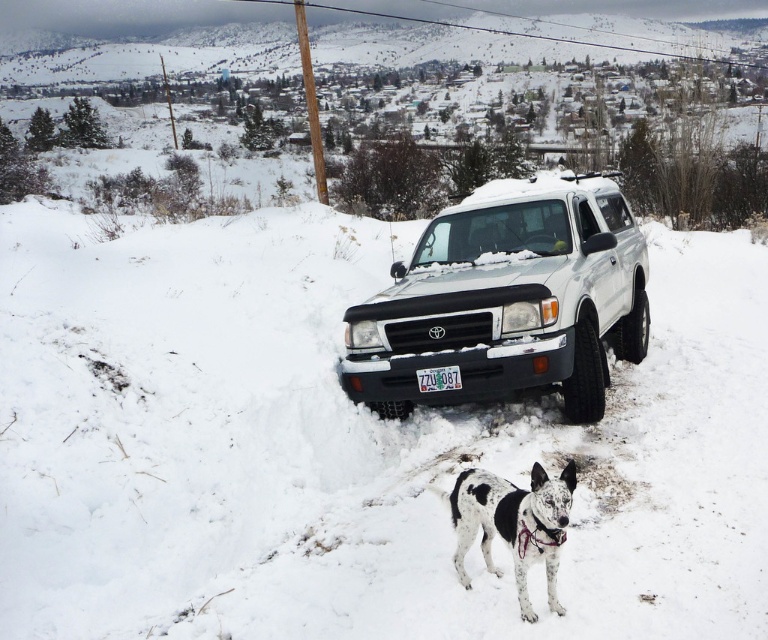
Question: Can you confirm if white matte suv at center is positioned above spotted fur dog at center?

Choices:
 (A) no
 (B) yes

Answer: (B)

Question: Which of these objects is positioned closest to the spotted fur dog at center?

Choices:
 (A) white plastic license plate at center
 (B) white matte suv at center

Answer: (A)

Question: Which of the following is the closest to the observer?

Choices:
 (A) (551, 576)
 (B) (469, 292)
 (C) (445, 374)

Answer: (A)

Question: Is white matte suv at center further to the viewer compared to spotted fur dog at center?

Choices:
 (A) yes
 (B) no

Answer: (A)

Question: Among these points, which one is nearest to the camera?

Choices:
 (A) tap(475, 304)
 (B) tap(439, 385)
 (C) tap(541, 497)

Answer: (C)

Question: Does white matte suv at center appear on the left side of white plastic license plate at center?

Choices:
 (A) no
 (B) yes

Answer: (A)